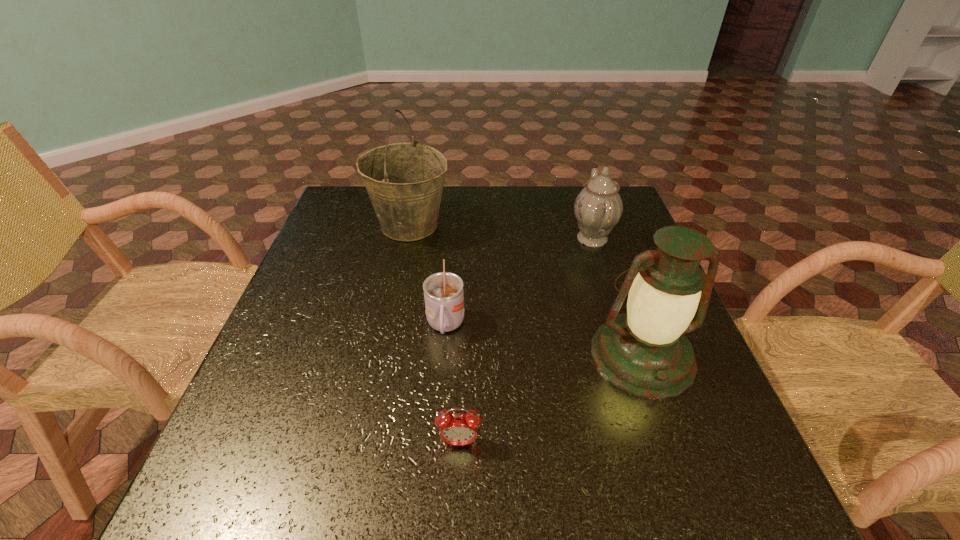
Find the location of a particular element. The width and height of the screenshot is (960, 540). vacant area between the second shortest object and the alarm clock is located at coordinates (452, 384).

The width and height of the screenshot is (960, 540). What are the coordinates of `free space between the wine bucket and the lantern` in the screenshot? It's located at (525, 291).

I want to click on vacant area that lies between the third tallest object and the alarm clock, so click(x=526, y=340).

This screenshot has width=960, height=540. I want to click on vacant point located between the third tallest object and the cup, so 518,282.

Image resolution: width=960 pixels, height=540 pixels. Identify the location of the fourth closest object to the nearest object. (598, 207).

Where is `object identified as the closest to the second shortest object`? object identified as the closest to the second shortest object is located at coordinates (458, 429).

In order to click on vacant area in the image that satisfies the following two spatial constraints: 1. on the spout of the third tallest object; 2. on the side with the handle of the fourth tallest object in this screenshot , I will do `click(620, 326)`.

Image resolution: width=960 pixels, height=540 pixels. In order to click on free spot that satisfies the following two spatial constraints: 1. on the spout of the chinaware; 2. on the face of the alarm clock in this screenshot , I will do (659, 442).